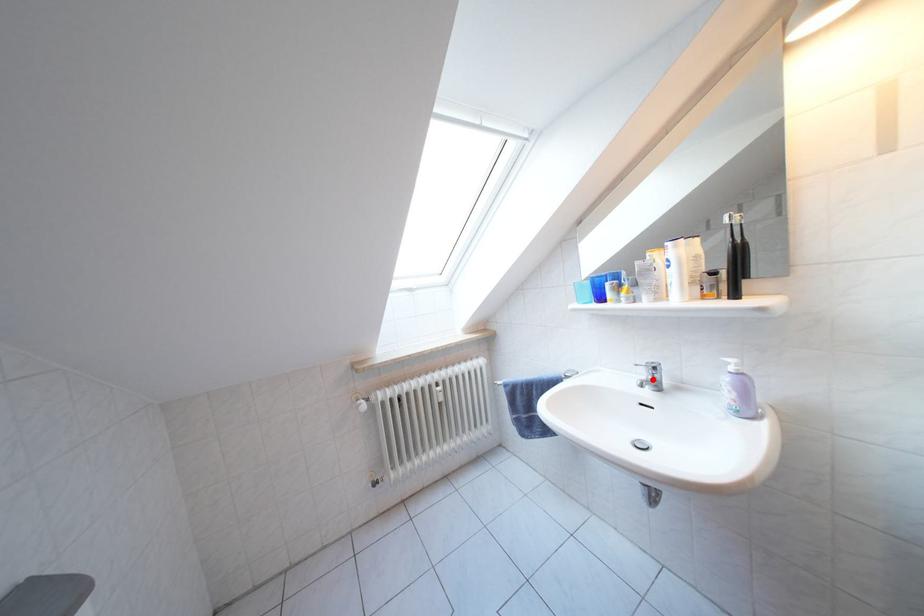
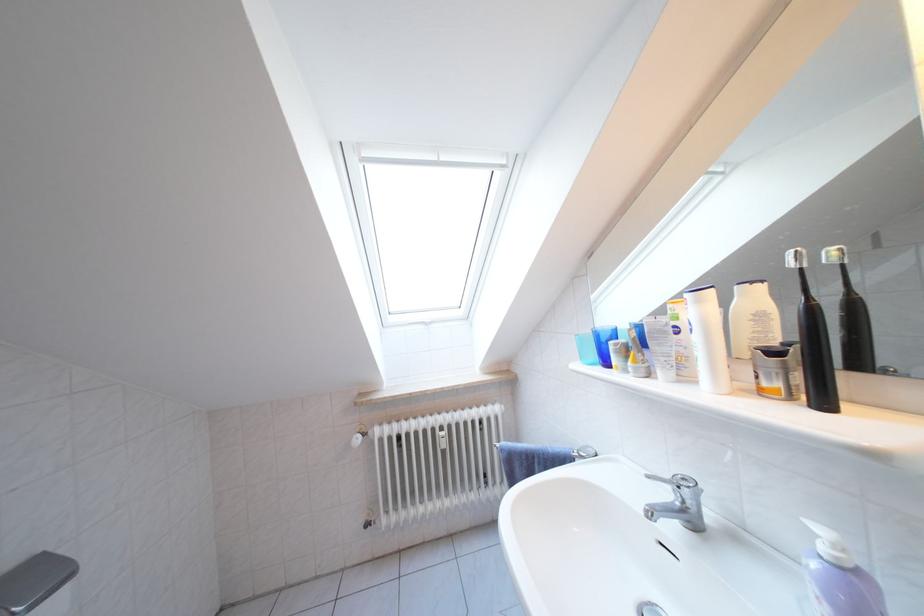
In the second image, find the point that corresponds to the highlighted location in the first image.

(675, 500)